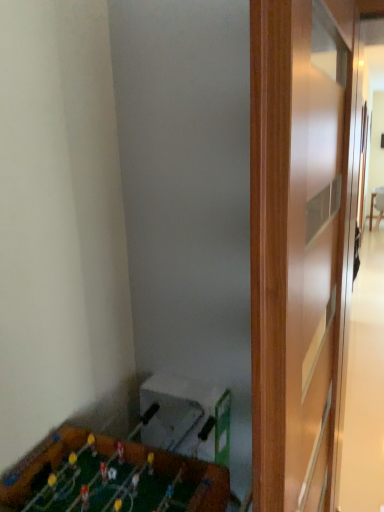
What is the approximate height of wooden table at right?

wooden table at right is 23.97 inches in height.

The height and width of the screenshot is (512, 384). What do you see at coordinates (377, 206) in the screenshot?
I see `wooden table at right` at bounding box center [377, 206].

Locate an element on the screen. This screenshot has height=512, width=384. wooden table at right is located at coordinates (x=377, y=206).

Where is `wooden foosball table at lower left`? The width and height of the screenshot is (384, 512). wooden foosball table at lower left is located at coordinates (111, 480).

Image resolution: width=384 pixels, height=512 pixels. What do you see at coordinates (111, 480) in the screenshot?
I see `wooden foosball table at lower left` at bounding box center [111, 480].

You are a GUI agent. You are given a task and a screenshot of the screen. Output one action in this format:
    pyautogui.click(x=<x>, y=<y>)
    Task: Click on the wooden table at right
    The width and height of the screenshot is (384, 512).
    Given the screenshot: What is the action you would take?
    pyautogui.click(x=377, y=206)

Considering the positions of objects wooden foosball table at lower left and wooden table at right in the image provided, who is more to the right, wooden foosball table at lower left or wooden table at right?

wooden table at right is more to the right.

Does wooden foosball table at lower left lie behind wooden table at right?

No, wooden foosball table at lower left is closer to the camera.

Does point (212, 480) appear closer or farther from the camera than point (374, 206)?

Point (212, 480) appears to be closer to the viewer than point (374, 206).

From the image's perspective, relative to wooden table at right, is wooden foosball table at lower left above or below?

wooden foosball table at lower left is below wooden table at right.

From a real-world perspective, is wooden foosball table at lower left physically located above or below wooden table at right?

From a real-world perspective, wooden foosball table at lower left is physically above wooden table at right.

Considering the relative sizes of wooden foosball table at lower left and wooden table at right in the image provided, is wooden foosball table at lower left thinner than wooden table at right?

Incorrect, the width of wooden foosball table at lower left is not less than that of wooden table at right.

Considering the relative sizes of wooden foosball table at lower left and wooden table at right in the image provided, is wooden foosball table at lower left shorter than wooden table at right?

Yes.

Is wooden foosball table at lower left smaller than wooden table at right?

Actually, wooden foosball table at lower left might be larger than wooden table at right.

Is wooden table at right located within wooden foosball table at lower left?

Actually, wooden table at right is outside wooden foosball table at lower left.

Is wooden foosball table at lower left in contact with wooden table at right?

No, wooden foosball table at lower left is not beside wooden table at right.

Is wooden foosball table at lower left turned away from wooden table at right?

No, wooden foosball table at lower left's orientation is not away from wooden table at right.

How different are the orientations of wooden foosball table at lower left and wooden table at right in degrees?

87.8 degrees.

This screenshot has height=512, width=384. In order to click on furniture in front of the wooden table at right in this screenshot , I will do `click(111, 480)`.

Considering the relative positions of wooden table at right and wooden foosball table at lower left in the image provided, is wooden table at right to the left or to the right of wooden foosball table at lower left?

From the image, it's evident that wooden table at right is to the right of wooden foosball table at lower left.

Which object is closer to the camera, wooden table at right or wooden foosball table at lower left?

Positioned in front is wooden foosball table at lower left.

Is point (372, 219) closer to camera compared to point (200, 474)?

No, it is not.

From the image's perspective, between wooden table at right and wooden foosball table at lower left, which one is located above?

wooden table at right.

From a real-world perspective, is wooden table at right below wooden foosball table at lower left?

Indeed, from a real-world perspective, wooden table at right is positioned beneath wooden foosball table at lower left.

Looking at their sizes, would you say wooden table at right is wider or thinner than wooden foosball table at lower left?

Clearly, wooden table at right has less width compared to wooden foosball table at lower left.

Considering the sizes of wooden table at right and wooden foosball table at lower left in the image, is wooden table at right taller or shorter than wooden foosball table at lower left?

Considering their sizes, wooden table at right has more height than wooden foosball table at lower left.

Which of these two, wooden table at right or wooden foosball table at lower left, is smaller?

Smaller between the two is wooden table at right.

From the picture: Is wooden table at right spatially inside wooden foosball table at lower left, or outside of it?

wooden table at right is not inside wooden foosball table at lower left, it's outside.

Is wooden table at right not close to wooden foosball table at lower left?

Yes, wooden table at right and wooden foosball table at lower left are quite far apart.

Could you tell me if wooden table at right is facing wooden foosball table at lower left?

No.

How far apart are wooden table at right and wooden foosball table at lower left?

8.56 feet.

Where is `furniture that appears in front of the wooden table at right`? The width and height of the screenshot is (384, 512). furniture that appears in front of the wooden table at right is located at coordinates (111, 480).

This screenshot has height=512, width=384. What are the coordinates of `furniture that is in front of the wooden table at right` in the screenshot? It's located at (111, 480).

This screenshot has height=512, width=384. I want to click on table that is behind the wooden foosball table at lower left, so click(377, 206).